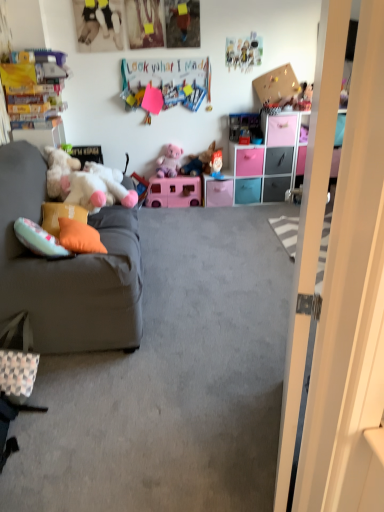
Question: Is pink plastic drawer at center, placed as the 4th drawer when sorted from left to right, smaller than blue fabric doll at center, which ranks as the third toy in left-to-right order?

Choices:
 (A) yes
 (B) no

Answer: (B)

Question: From a real-world perspective, is pink plastic drawer at center, the third drawer from the right, beneath blue fabric doll at center, positioned as the fourth toy in top-to-bottom order?

Choices:
 (A) no
 (B) yes

Answer: (A)

Question: Does pink plastic drawer at center, the third drawer from the right, have a greater width compared to blue fabric doll at center, the third toy when ordered from right to left?

Choices:
 (A) no
 (B) yes

Answer: (B)

Question: Would you say pink plastic drawer at center, placed as the 4th drawer when sorted from left to right, is outside blue fabric doll at center, positioned as the 2th toy in bottom-to-top order?

Choices:
 (A) yes
 (B) no

Answer: (A)

Question: Is pink plastic drawer at center, placed as the 4th drawer when sorted from left to right, looking in the opposite direction of blue fabric doll at center, positioned as the fourth toy in top-to-bottom order?

Choices:
 (A) no
 (B) yes

Answer: (A)

Question: Is pink plastic drawer at center, the third drawer from the right, taller or shorter than teal plastic drawer at center, the 4th drawer when ordered from right to left?

Choices:
 (A) short
 (B) tall

Answer: (B)

Question: Relative to teal plastic drawer at center, which is the third drawer from left to right, is pink plastic drawer at center, the third drawer from the right, in front or behind?

Choices:
 (A) front
 (B) behind

Answer: (A)

Question: From the image's perspective, is pink plastic drawer at center, the third drawer from the right, positioned above or below teal plastic drawer at center, which is the third drawer from left to right?

Choices:
 (A) above
 (B) below

Answer: (A)

Question: Is pink plastic drawer at center, the third drawer from the right, to the left or to the right of teal plastic drawer at center, the 4th drawer when ordered from right to left, in the image?

Choices:
 (A) left
 (B) right

Answer: (B)

Question: In terms of size, does orange fabric pillow at left, which is the first pillow from back to front, appear bigger or smaller than checkered fabric bag at lower left?

Choices:
 (A) big
 (B) small

Answer: (B)

Question: From a real-world perspective, is orange fabric pillow at left, the 2th pillow positioned from the front, above or below checkered fabric bag at lower left?

Choices:
 (A) below
 (B) above

Answer: (B)

Question: From the image's perspective, is orange fabric pillow at left, which is the first pillow from back to front, positioned above or below checkered fabric bag at lower left?

Choices:
 (A) below
 (B) above

Answer: (B)

Question: Is orange fabric pillow at left, which is the first pillow from back to front, in front of or behind checkered fabric bag at lower left in the image?

Choices:
 (A) front
 (B) behind

Answer: (B)

Question: Does point (218, 172) appear closer or farther from the camera than point (243, 200)?

Choices:
 (A) closer
 (B) farther

Answer: (B)

Question: From a real-world perspective, is blue fabric doll at center, positioned as the 2th toy in bottom-to-top order, physically located above or below teal plastic drawer at center, the 4th drawer when ordered from right to left?

Choices:
 (A) above
 (B) below

Answer: (A)